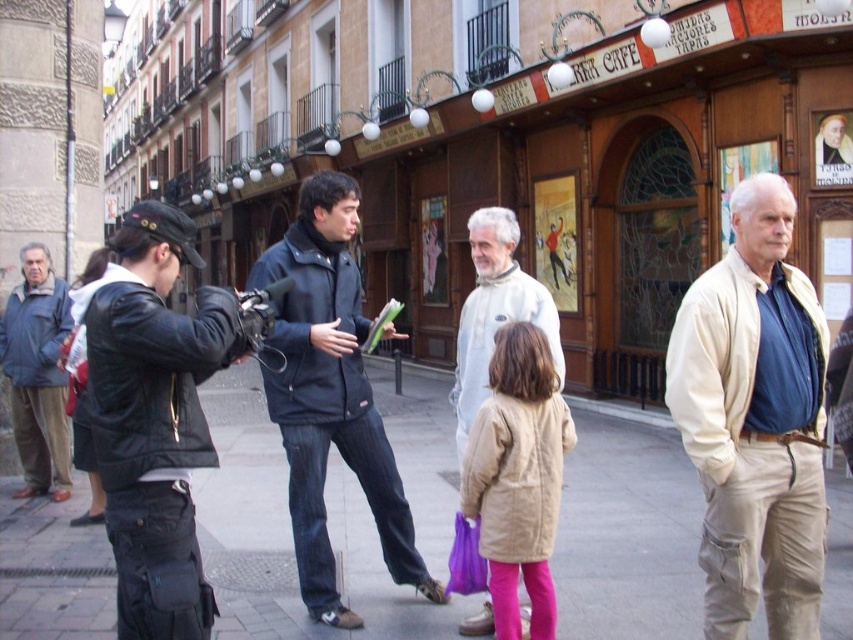
In the scene shown: Please provide the coordinates of the dark blue jacket at center in the image, using the coordinate system where the bottom left corner is the origin point.

The coordinates of the dark blue jacket at center are at point (329, 394).

You are a photographer trying to capture a candid shot of both the black leather jacket at left and the dark blue jacket at center. Since you can only focus on one subject at a time, which jacket should you focus on to ensure the other remains in the background?

You should focus on the black leather jacket at left because it is in front of the dark blue jacket at center, so if you focus on the front jacket, the one behind will naturally be in the background.